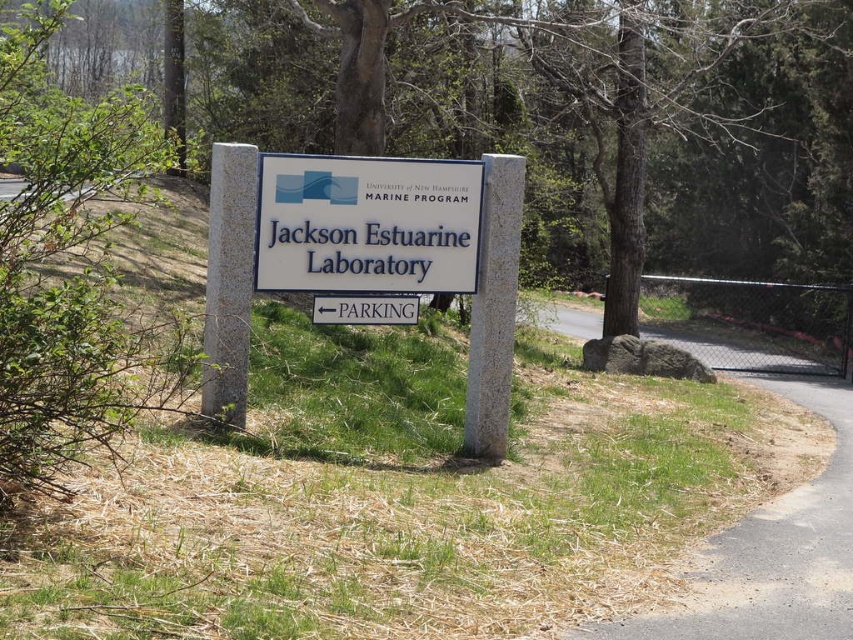
You need to park your car in a spot that can accommodate a vehicle that is 2 meters wide. The parking area is near the white plastic sign at center. Is the asphalt road at lower right wide enough for your car?

The asphalt road at lower right might be wider than white plastic sign at center, so it is possible that the road is wide enough for a 2 meter wide vehicle. However, since the exact width isn not provided, you should check the actual road width before parking.